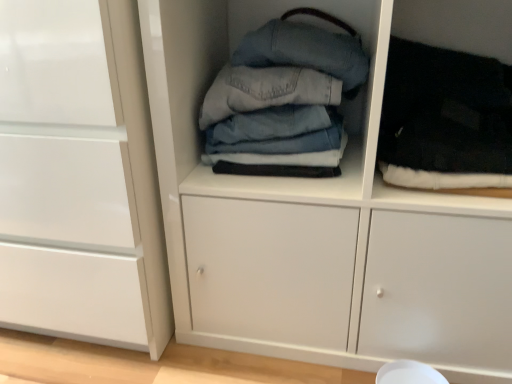
Question: Is white glossy cabinet at left completely or partially inside denim fabric jeans at center, which ranks as the first clothing in left-to-right order?

Choices:
 (A) no
 (B) yes

Answer: (A)

Question: Can you confirm if denim fabric jeans at center, which ranks as the first clothing in left-to-right order, is shorter than white glossy cabinet at left?

Choices:
 (A) no
 (B) yes

Answer: (B)

Question: Are denim fabric jeans at center, which ranks as the first clothing in left-to-right order, and white glossy cabinet at left far apart?

Choices:
 (A) no
 (B) yes

Answer: (A)

Question: Does denim fabric jeans at center, which ranks as the first clothing in left-to-right order, have a lesser width compared to white glossy cabinet at left?

Choices:
 (A) no
 (B) yes

Answer: (B)

Question: Is denim fabric jeans at center, acting as the second clothing starting from the right, at the left side of white glossy cabinet at left?

Choices:
 (A) yes
 (B) no

Answer: (B)

Question: Can you confirm if denim fabric jeans at center, which ranks as the first clothing in left-to-right order, is taller than white glossy cabinet at left?

Choices:
 (A) yes
 (B) no

Answer: (B)

Question: Can you confirm if black fuzzy socks at right, the first clothing in the right-to-left sequence, is taller than denim fabric jeans at center, acting as the second clothing starting from the right?

Choices:
 (A) no
 (B) yes

Answer: (A)

Question: Is black fuzzy socks at right, the first clothing in the right-to-left sequence, positioned with its back to denim fabric jeans at center, acting as the second clothing starting from the right?

Choices:
 (A) yes
 (B) no

Answer: (B)

Question: Is black fuzzy socks at right, the first clothing in the right-to-left sequence, further to the viewer compared to denim fabric jeans at center, acting as the second clothing starting from the right?

Choices:
 (A) yes
 (B) no

Answer: (B)

Question: Is there a large distance between black fuzzy socks at right, which is the 2th clothing in left-to-right order, and denim fabric jeans at center, which ranks as the first clothing in left-to-right order?

Choices:
 (A) no
 (B) yes

Answer: (A)

Question: Considering the relative sizes of black fuzzy socks at right, which is the 2th clothing in left-to-right order, and denim fabric jeans at center, acting as the second clothing starting from the right, in the image provided, is black fuzzy socks at right, which is the 2th clothing in left-to-right order, shorter than denim fabric jeans at center, acting as the second clothing starting from the right,?

Choices:
 (A) no
 (B) yes

Answer: (B)

Question: Is black fuzzy socks at right, which is the 2th clothing in left-to-right order, smaller than denim fabric jeans at center, which ranks as the first clothing in left-to-right order?

Choices:
 (A) no
 (B) yes

Answer: (B)

Question: Does white glossy cabinet at left have a larger size compared to denim fabric stack at center?

Choices:
 (A) yes
 (B) no

Answer: (A)